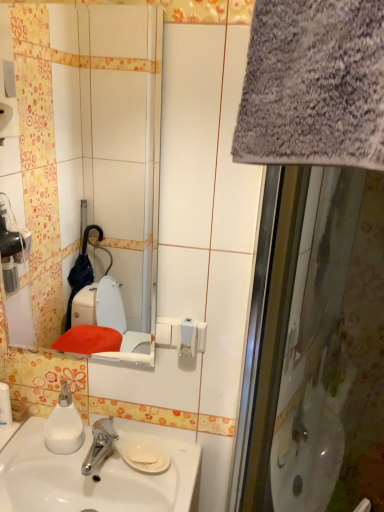
Identify the location of free space that is to the left of white matte soap dispenser at lower left. This screenshot has height=512, width=384. (26, 451).